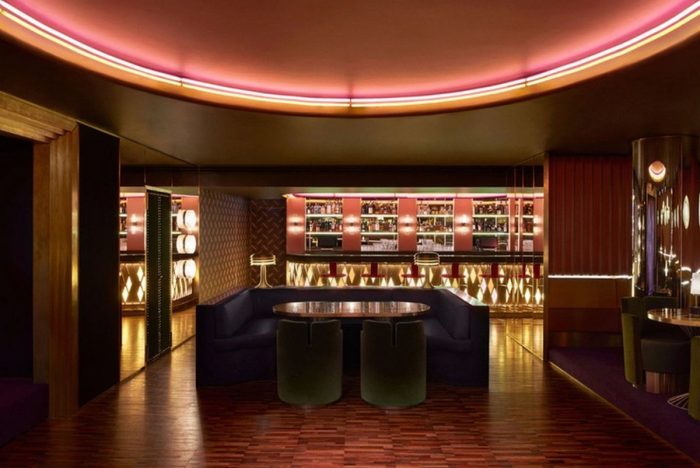
This screenshot has width=700, height=468. I want to click on lighter pink color ceiling area, so click(x=362, y=90).